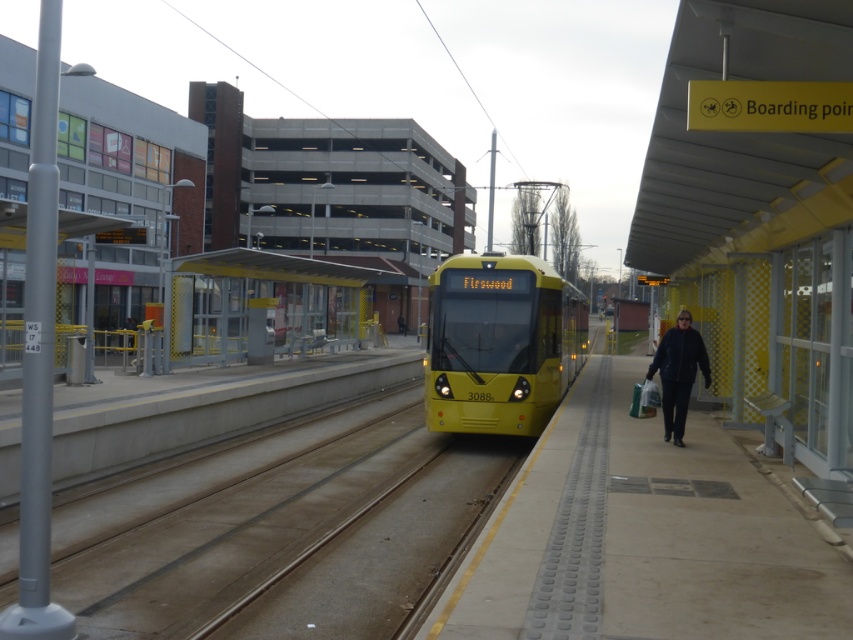
You are a passenger waiting at the tram station and need to board the tram. You are currently standing at the yellow metallic bus stop at center. Which direction should you walk to reach the smooth concrete platform at center where the tram is located?

The smooth concrete platform at center is positioned on the right side of the yellow metallic bus stop at center, so you should walk to your right to reach it.

Based on the photo, you are a delivery person trying to park your 2.5 meter wide delivery van at the tram station. The van needs to be parked parallel to the tram tracks. The smooth concrete platform at center and the yellow metallic bus stop at center are both located along the tracks. Which area would you choose to park your van without overhanging the edges?

The smooth concrete platform at center has a greater width than the yellow metallic bus stop at center, so you should park the van on the smooth concrete platform at center to accommodate the 2.5 meter width without overhanging the edges.

You are standing at the tram station and want to take a photo of the tram and the waiting area. The tram is at point (712, 445) and the waiting area is at point (236, 314). If you want both to be in focus, which point should be your focus point?

Point (712, 445) is closer to the camera than point (236, 314). To have both the tram and the waiting area in focus, you should focus on the point that is further away, which is point (236, 314). This way, the closer point will still be within the depth of field.